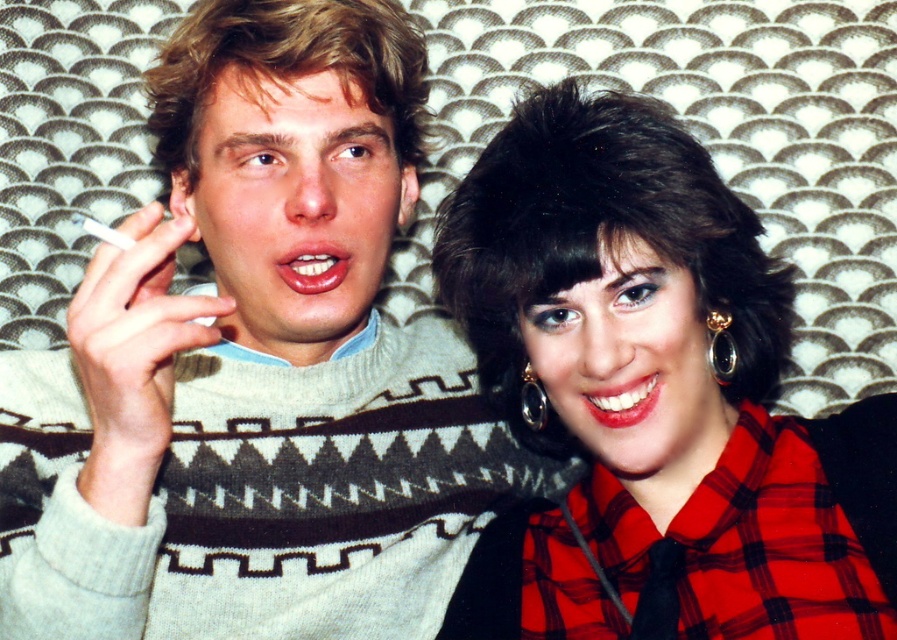
Is point (729, 368) positioned in front of point (540, 419)?

Yes, it is.

Between gold metallic earring at upper right and black shiny earring at upper right, which one appears on the left side from the viewer's perspective?

Positioned to the left is black shiny earring at upper right.

I want to click on gold metallic earring at upper right, so click(721, 346).

Is red plaid shirt at center above black shiny earring at upper right?

Yes, red plaid shirt at center is above black shiny earring at upper right.

Is red plaid shirt at center further to camera compared to black shiny earring at upper right?

That is False.

Between point (656, 632) and point (546, 410), which one is positioned in front?

Point (656, 632) is more forward.

The height and width of the screenshot is (640, 897). I want to click on red plaid shirt at center, so click(x=654, y=396).

Between point (707, 589) and point (732, 339), which one is positioned in front?

Point (707, 589) is more forward.

How distant is red plaid shirt at center from gold metallic earring at upper right?

red plaid shirt at center and gold metallic earring at upper right are 5.08 inches apart from each other.

The image size is (897, 640). Find the location of `red plaid shirt at center`. red plaid shirt at center is located at coordinates (654, 396).